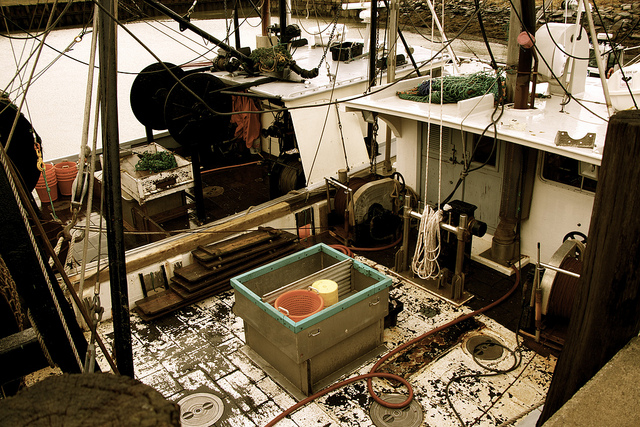
I want to click on windows, so click(x=563, y=166), click(x=477, y=142).